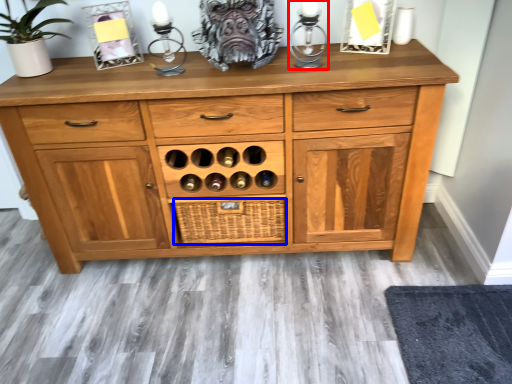
Question: Which object is closer to the camera taking this photo, candle holder (highlighted by a red box) or crate (highlighted by a blue box)?

Choices:
 (A) candle holder
 (B) crate

Answer: (A)